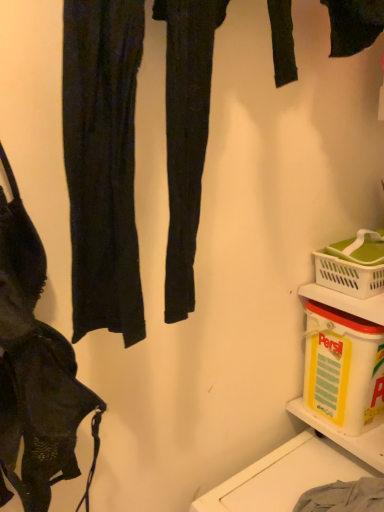
What do you see at coordinates (35, 371) in the screenshot? I see `matte black bra at left` at bounding box center [35, 371].

Where is `yellow plastic container at lower right`? yellow plastic container at lower right is located at coordinates (343, 367).

Where is `gray cotton towel at lower right`? gray cotton towel at lower right is located at coordinates (285, 476).

Are matte black bra at left and yellow plastic container at lower right beside each other?

matte black bra at left is not next to yellow plastic container at lower right, and they're not touching.

Locate an element on the screen. box below the matte black bra at left (from a real-world perspective) is located at coordinates (343, 367).

Considering the positions of point (41, 336) and point (364, 422), is point (41, 336) closer or farther from the camera than point (364, 422)?

Point (41, 336) appears to be closer to the viewer than point (364, 422).

How many degrees apart are the facing directions of matte black bra at left and yellow plastic container at lower right?

There is a 90.2-degree angle between the facing directions of matte black bra at left and yellow plastic container at lower right.

Would you say yellow plastic container at lower right is to the left or to the right of white plastic container at lower right in the picture?

yellow plastic container at lower right is positioned on white plastic container at lower right's left side.

From their relative heights in the image, would you say yellow plastic container at lower right is taller or shorter than white plastic container at lower right?

yellow plastic container at lower right is taller than white plastic container at lower right.

Considering the positions of objects yellow plastic container at lower right and white plastic container at lower right in the image provided, who is in front, yellow plastic container at lower right or white plastic container at lower right?

Positioned in front is yellow plastic container at lower right.

In the scene shown: From a real-world perspective, which object stands above the other?

white plastic picnic basket at lower right, from a real-world perspective.

Looking at this image, would you say white plastic container at lower right is inside or outside white plastic picnic basket at lower right?

white plastic container at lower right is located beyond the bounds of white plastic picnic basket at lower right.

Does white plastic container at lower right turn towards white plastic picnic basket at lower right?

No, white plastic container at lower right is not aimed at white plastic picnic basket at lower right.

From the image's perspective, is white plastic container at lower right over white plastic picnic basket at lower right?

No, from the image's perspective, white plastic container at lower right is not on top of white plastic picnic basket at lower right.

From the image's perspective, is white plastic picnic basket at lower right over yellow plastic container at lower right?

Yes, from the image's perspective, white plastic picnic basket at lower right is over yellow plastic container at lower right.

Is there a large distance between white plastic picnic basket at lower right and yellow plastic container at lower right?

No, white plastic picnic basket at lower right is in close proximity to yellow plastic container at lower right.

Can we say white plastic picnic basket at lower right lies outside yellow plastic container at lower right?

white plastic picnic basket at lower right is positioned outside yellow plastic container at lower right.

Which object is closer to the camera, white plastic picnic basket at lower right or yellow plastic container at lower right?

yellow plastic container at lower right.

Locate an element on the screen. box on the left of white plastic picnic basket at lower right is located at coordinates (343, 367).

Considering the relative sizes of yellow plastic container at lower right and white plastic picnic basket at lower right in the image provided, is yellow plastic container at lower right smaller than white plastic picnic basket at lower right?

Actually, yellow plastic container at lower right might be larger than white plastic picnic basket at lower right.

Relative to white plastic picnic basket at lower right, is yellow plastic container at lower right in front or behind?

yellow plastic container at lower right is positioned closer to the viewer than white plastic picnic basket at lower right.

Is yellow plastic container at lower right to the left of white plastic picnic basket at lower right from the viewer's perspective?

Indeed, yellow plastic container at lower right is positioned on the left side of white plastic picnic basket at lower right.

From a real-world perspective, between white plastic picnic basket at lower right and white plastic container at lower right, who is vertically lower?

white plastic container at lower right is physically lower.

You are a GUI agent. You are given a task and a screenshot of the screen. Output one action in this format:
    pyautogui.click(x=<x>, y=<y>)
    Task: Click on the shelf that appears in front of the white plastic picnic basket at lower right
    
    Given the screenshot: What is the action you would take?
    pyautogui.click(x=347, y=435)

Is white plastic picnic basket at lower right in front of or behind white plastic container at lower right in the image?

white plastic picnic basket at lower right is behind white plastic container at lower right.

From the image's perspective, which is above, white plastic picnic basket at lower right or white plastic container at lower right?

white plastic picnic basket at lower right appears higher in the image.

Considering the positions of point (8, 384) and point (376, 440), is point (8, 384) closer or farther from the camera than point (376, 440)?

Point (8, 384).

Between matte black bra at left and white plastic container at lower right, which one has larger size?

Bigger between the two is matte black bra at left.

Identify the location of handbag in front of the white plastic container at lower right. (35, 371).

What are the coordinates of `box that appears behind the matte black bra at left` in the screenshot? It's located at (343, 367).

I want to click on shelf that is under the yellow plastic container at lower right (from a real-world perspective), so click(x=347, y=435).

Which object lies nearer to the anchor point white plastic picnic basket at lower right, gray cotton towel at lower right or yellow plastic container at lower right?

The object closer to white plastic picnic basket at lower right is yellow plastic container at lower right.

When comparing their distances from white plastic container at lower right, does gray cotton towel at lower right or yellow plastic container at lower right seem closer?

The object closer to white plastic container at lower right is gray cotton towel at lower right.

Estimate the real-world distances between objects in this image. Which object is further from white plastic container at lower right, yellow plastic container at lower right or white plastic picnic basket at lower right?

white plastic picnic basket at lower right is further to white plastic container at lower right.

Looking at the image, which one is located closer to yellow plastic container at lower right, white plastic container at lower right or matte black bra at left?

The object closer to yellow plastic container at lower right is white plastic container at lower right.

Which object lies further to the anchor point white plastic picnic basket at lower right, white plastic container at lower right or matte black bra at left?

matte black bra at left.

When comparing their distances from white plastic container at lower right, does white plastic picnic basket at lower right or matte black bra at left seem further?

matte black bra at left.

When comparing their distances from yellow plastic container at lower right, does gray cotton towel at lower right or white plastic picnic basket at lower right seem further?

gray cotton towel at lower right.

Estimate the real-world distances between objects in this image. Which object is closer to yellow plastic container at lower right, gray cotton towel at lower right or white plastic container at lower right?

white plastic container at lower right is positioned closer to the anchor yellow plastic container at lower right.

Locate an element on the screen. The width and height of the screenshot is (384, 512). washing between matte black bra at left and white plastic picnic basket at lower right from left to right is located at coordinates (285, 476).

Find the location of a particular element. The image size is (384, 512). box between gray cotton towel at lower right and white plastic container at lower right along the z-axis is located at coordinates (343, 367).

I want to click on washing between matte black bra at left and white plastic container at lower right, so click(x=285, y=476).

You are a GUI agent. You are given a task and a screenshot of the screen. Output one action in this format:
    pyautogui.click(x=<x>, y=<y>)
    Task: Click on the picnic basket between matte black bra at left and white plastic container at lower right
    This screenshot has width=384, height=512.
    Given the screenshot: What is the action you would take?
    pyautogui.click(x=348, y=275)